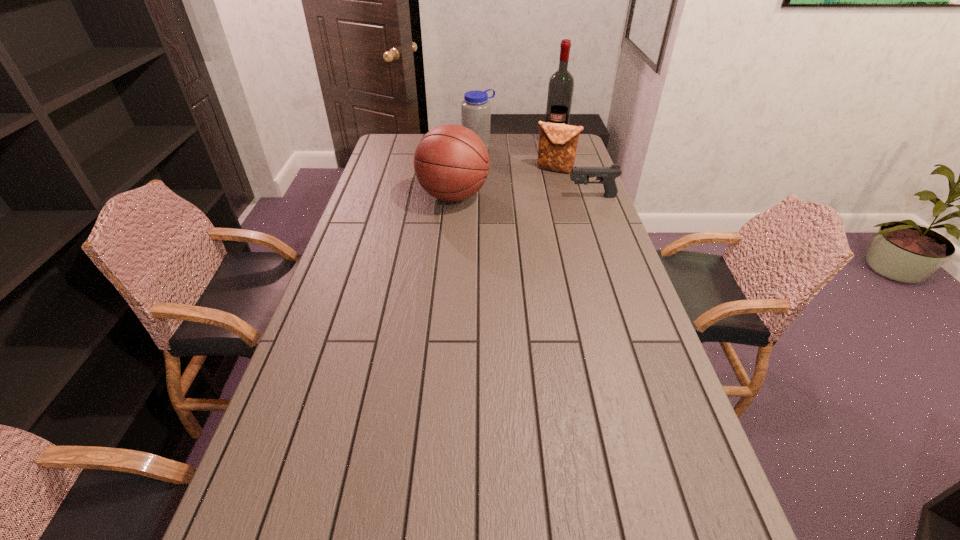
At what (x,y) coordinates should I click in order to perform the action: click on free space between the water bottle and the pistol. Please return your answer as a coordinate pair (x, y). Looking at the image, I should click on (535, 173).

The width and height of the screenshot is (960, 540). In order to click on vacant area that lies between the pistol and the clutch bag in this screenshot , I will do `click(573, 183)`.

The height and width of the screenshot is (540, 960). I want to click on unoccupied position between the water bottle and the fourth tallest object, so click(x=516, y=159).

What are the coordinates of `free spot between the fourth tallest object and the pistol` in the screenshot? It's located at (573, 183).

You are a GUI agent. You are given a task and a screenshot of the screen. Output one action in this format:
    pyautogui.click(x=<x>, y=<y>)
    Task: Click on the vacant space that's between the pistol and the basketball
    This screenshot has height=540, width=960.
    Given the screenshot: What is the action you would take?
    point(522,197)

Locate an element on the screen. The image size is (960, 540). free space between the basketball and the third nearest object is located at coordinates (504, 183).

Where is `object that is the closest to the clutch bag`? This screenshot has height=540, width=960. object that is the closest to the clutch bag is located at coordinates (561, 84).

Find the location of a particular element. This screenshot has width=960, height=540. the closest object to the water bottle is located at coordinates (557, 148).

What are the coordinates of `free space that satisfies the following two spatial constraints: 1. on the back side of the water bottle; 2. on the left side of the basketball` in the screenshot? It's located at (457, 148).

Locate an element on the screen. This screenshot has height=540, width=960. free spot that satisfies the following two spatial constraints: 1. on the front side of the shortest object; 2. at the barrel of the clutch bag is located at coordinates (563, 197).